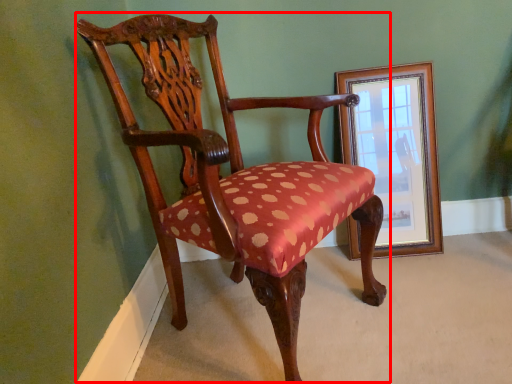
Question: From the image's perspective, what is the correct spatial positioning of chair (annotated by the red box) in reference to picture frame?

Choices:
 (A) below
 (B) above

Answer: (A)